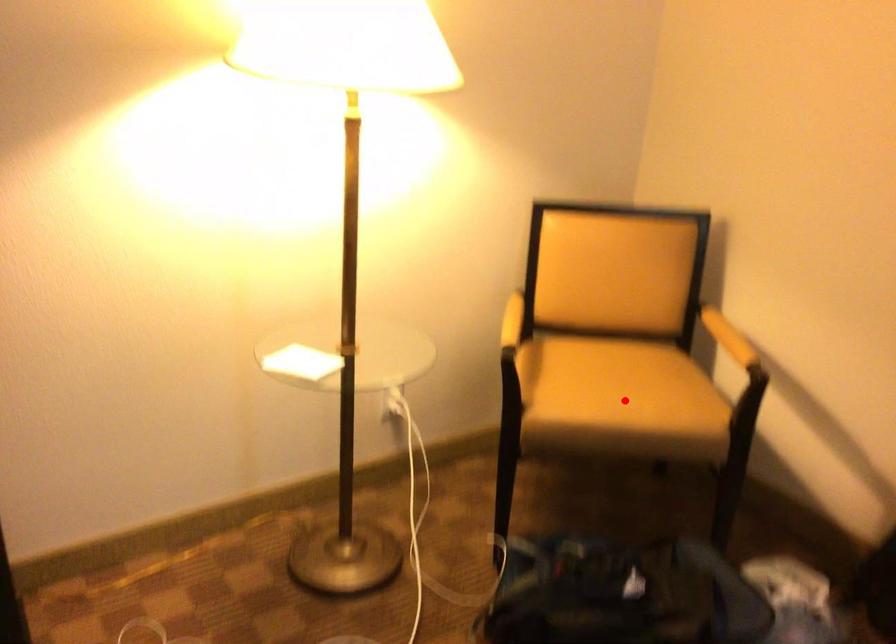
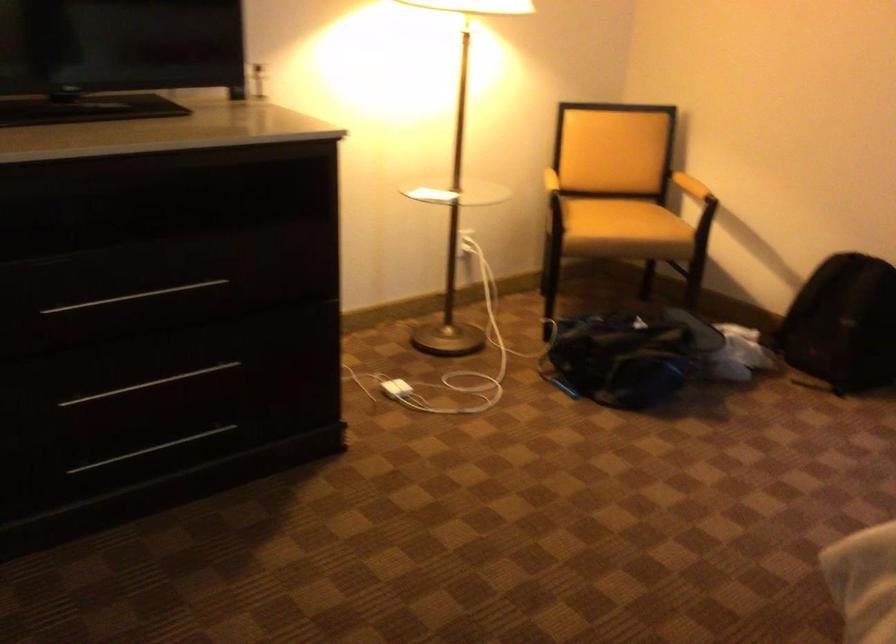
Where in the second image is the point corresponding to the highlighted location from the first image?

(623, 220)